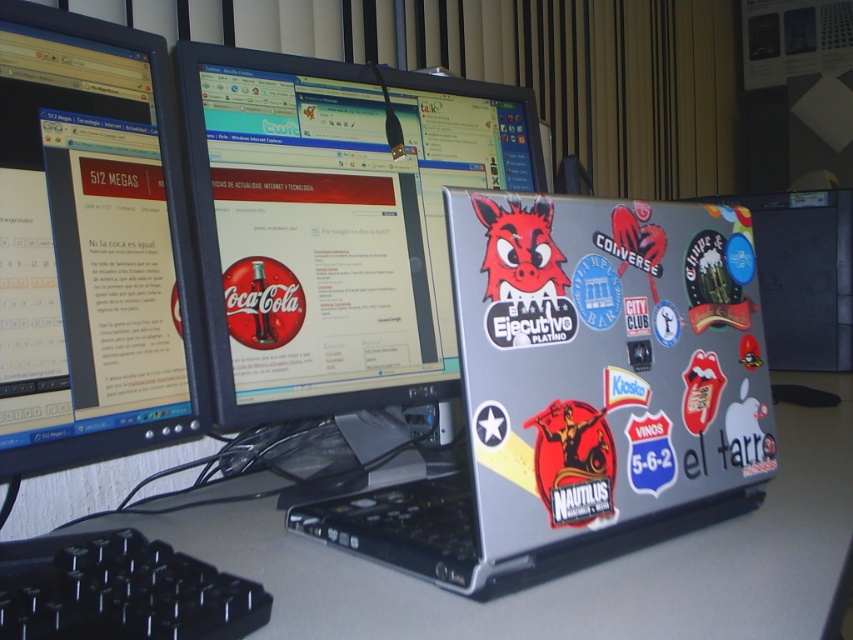
Question: Which point is farther to the camera?

Choices:
 (A) black glossy monitor at left
 (B) silver metallic computer desk at center

Answer: (A)

Question: Considering the relative positions of silver/stickered laptop at center and matte black monitor at center in the image provided, where is silver/stickered laptop at center located with respect to matte black monitor at center?

Choices:
 (A) below
 (B) above

Answer: (A)

Question: Can you confirm if silver/stickered laptop at center is positioned above matte black monitor at center?

Choices:
 (A) yes
 (B) no

Answer: (B)

Question: Does matte black monitor at center have a lesser width compared to black glossy monitor at left?

Choices:
 (A) yes
 (B) no

Answer: (B)

Question: Which object is farther from the camera taking this photo?

Choices:
 (A) black glossy monitor at left
 (B) silver/stickered laptop at center
 (C) black plastic keyboard at lower left

Answer: (A)

Question: Based on their relative distances, which object is nearer to the black glossy monitor at left?

Choices:
 (A) matte black monitor at center
 (B) silver metallic computer desk at center

Answer: (A)